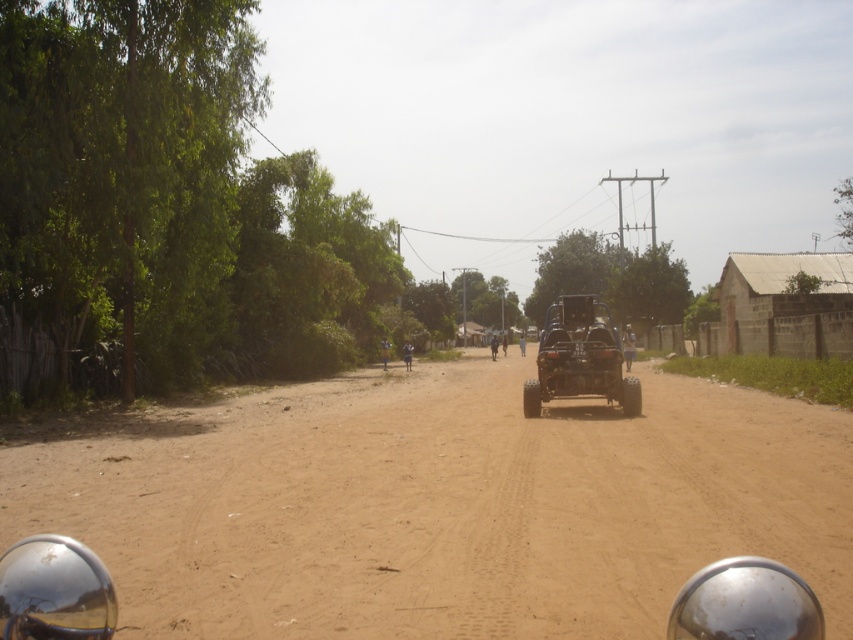
Which is behind, point (512, 428) or point (409, 346)?

The point (409, 346) is more distant.

Describe the element at coordinates (440, 506) in the screenshot. I see `brown sandy dirt at center` at that location.

Does point (68, 513) lie in front of point (410, 369)?

Yes, it is in front of point (410, 369).

The image size is (853, 640). I want to click on brown sandy dirt at center, so pos(440,506).

Does black matte jeep at center lie behind blue fabric motorcyclist at center?

No, black matte jeep at center is closer to the viewer.

From the picture: Can you confirm if black matte jeep at center is positioned above blue fabric motorcyclist at center?

Indeed, black matte jeep at center is positioned over blue fabric motorcyclist at center.

This screenshot has height=640, width=853. Describe the element at coordinates (579, 356) in the screenshot. I see `black matte jeep at center` at that location.

I want to click on black matte jeep at center, so click(579, 356).

Can you confirm if brown sandy dirt at center is bigger than black matte jeep at center?

No.

Measure the distance between point (737, 515) and camera.

7.49 meters

I want to click on brown sandy dirt at center, so click(440, 506).